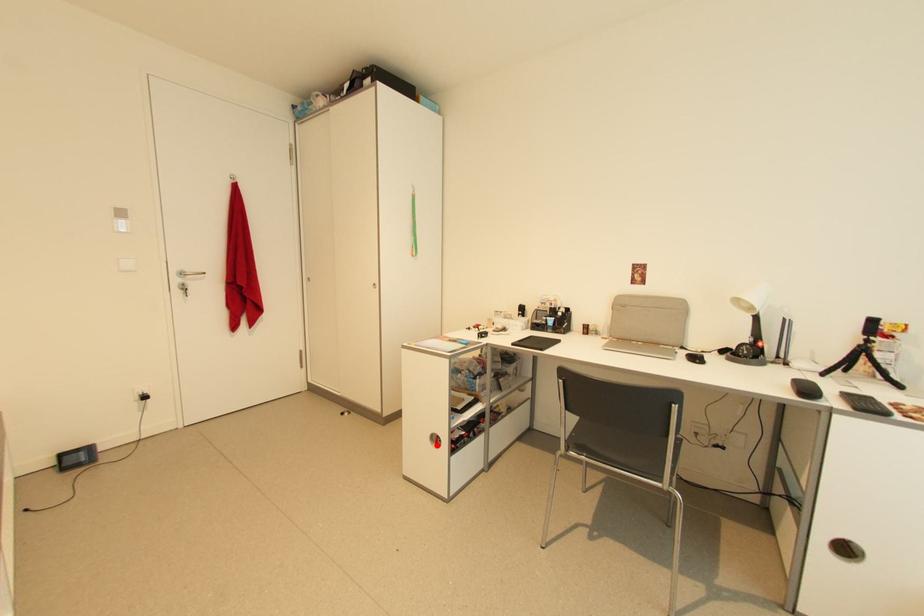
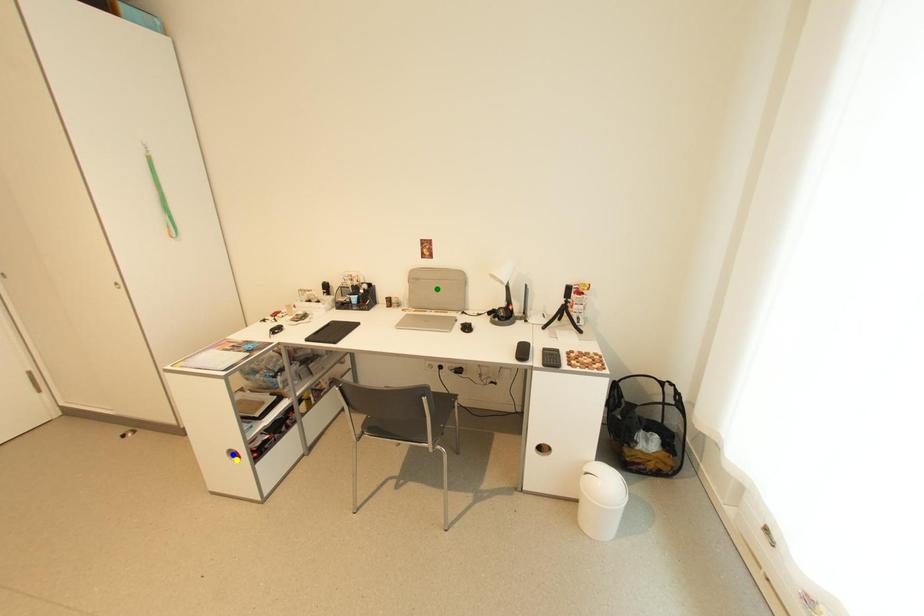
Question: I am providing you with two images of the same scene from different viewpoints. A red point is marked on the first image. You are given multiple points on the second image. In image 2, which mark is for the same physical point as the one in image 1?

Choices:
 (A) blue point
 (B) yellow point
 (C) green point

Answer: (B)